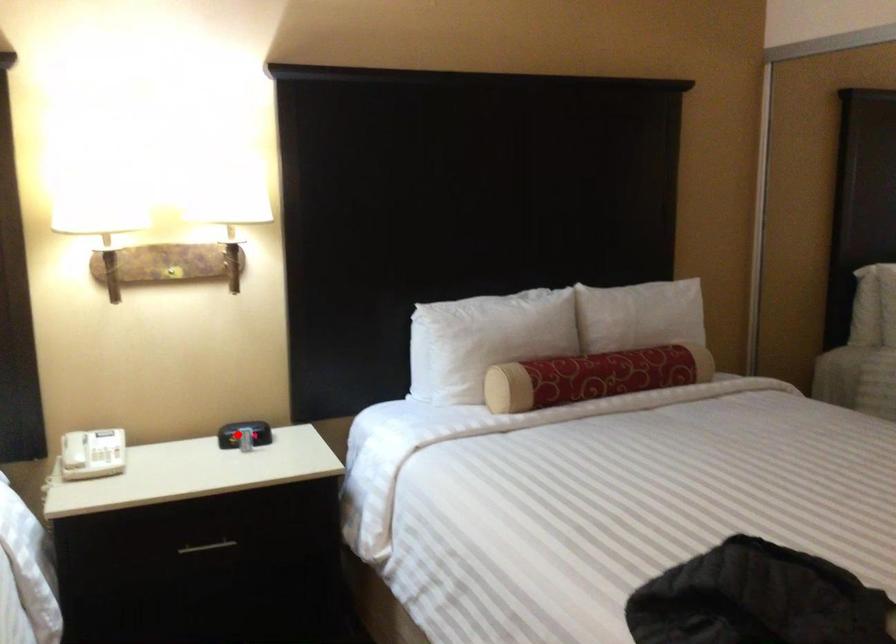
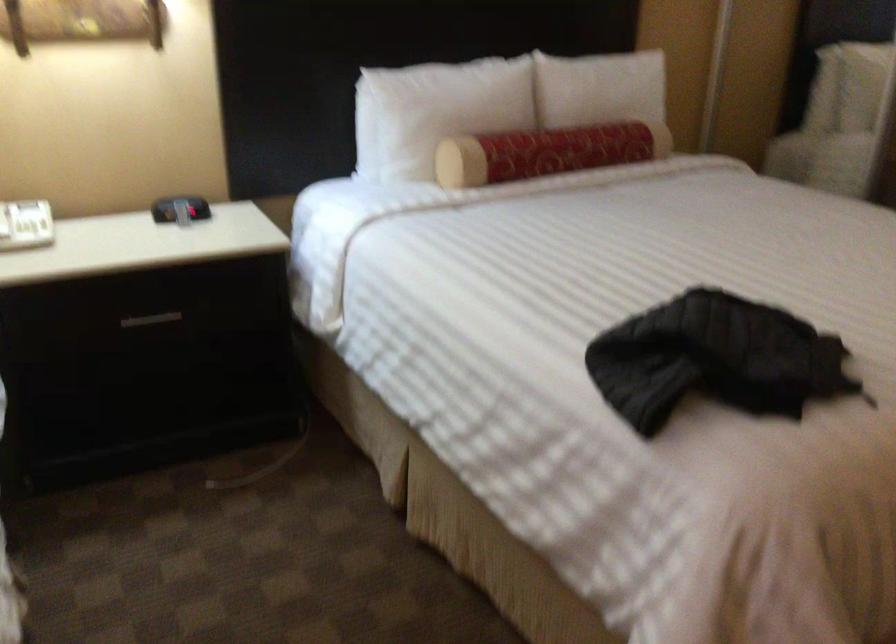
Locate, in the second image, the point that corresponds to the highlighted location in the first image.

(179, 209)